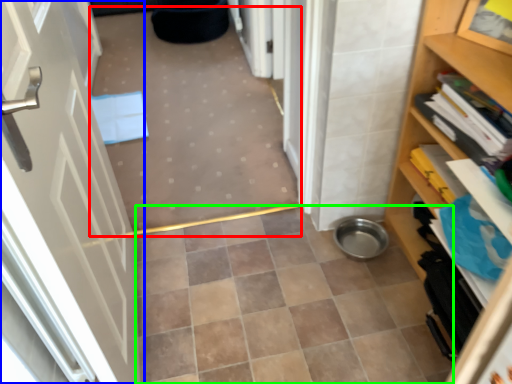
Question: Which object is the farthest from plain (highlighted by a red box)? Choose among these: door (highlighted by a blue box) or ceramic tile (highlighted by a green box).

Choices:
 (A) door
 (B) ceramic tile

Answer: (A)